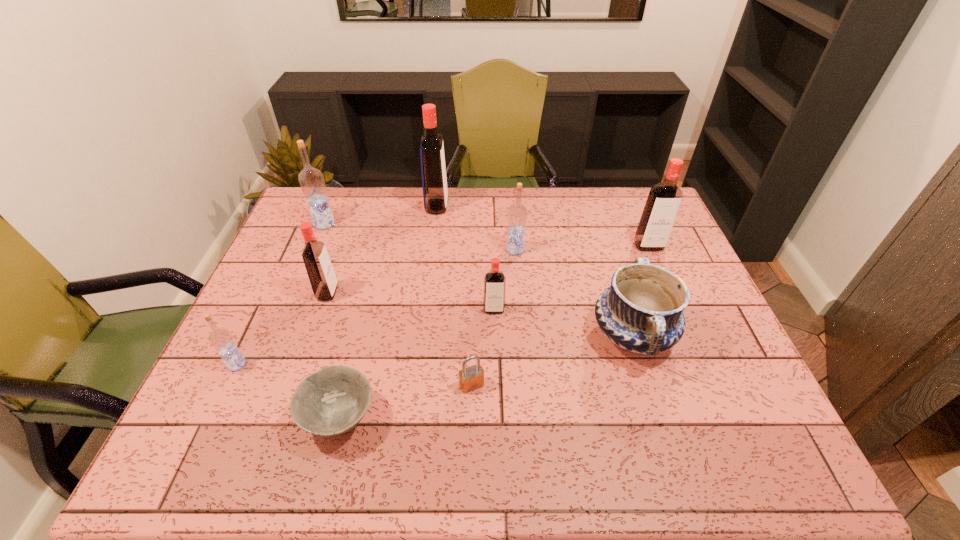
At what (x,y) coordinates should I click in order to perform the action: click on vacant region located on the front and back of the second farthest red vodka. Please return your answer as a coordinate pair (x, y). The image size is (960, 540). Looking at the image, I should click on (684, 327).

Find the location of a particular element. vacant area situated on the front and back of the third object from left to right is located at coordinates (375, 293).

At what (x,y) coordinates should I click in order to perform the action: click on free location located 0.090m on the back of the sixth vodka from left to right. Please return your answer as a coordinate pair (x, y). The width and height of the screenshot is (960, 540). Looking at the image, I should click on (513, 226).

Locate an element on the screen. Image resolution: width=960 pixels, height=540 pixels. free space located on the left of the blue pottery is located at coordinates coord(567,335).

Where is `free space located on the front and back of the smallest red vodka`? The width and height of the screenshot is (960, 540). free space located on the front and back of the smallest red vodka is located at coordinates (495, 357).

Identify the location of vacant space positioned on the right of the leftmost vodka. (377, 364).

Find the location of a particular element. free space located 0.300m on the back of the padlock is located at coordinates (473, 287).

Locate an element on the screen. vacant region located 0.140m on the back of the bowl is located at coordinates (359, 338).

Identify the location of object located at the near edge. The image size is (960, 540). (333, 400).

You are a GUI agent. You are given a task and a screenshot of the screen. Output one action in this format:
    pyautogui.click(x=<x>, y=<y>)
    Task: Click on the vodka located in the right edge section of the desktop
    The width and height of the screenshot is (960, 540).
    Given the screenshot: What is the action you would take?
    pyautogui.click(x=663, y=202)